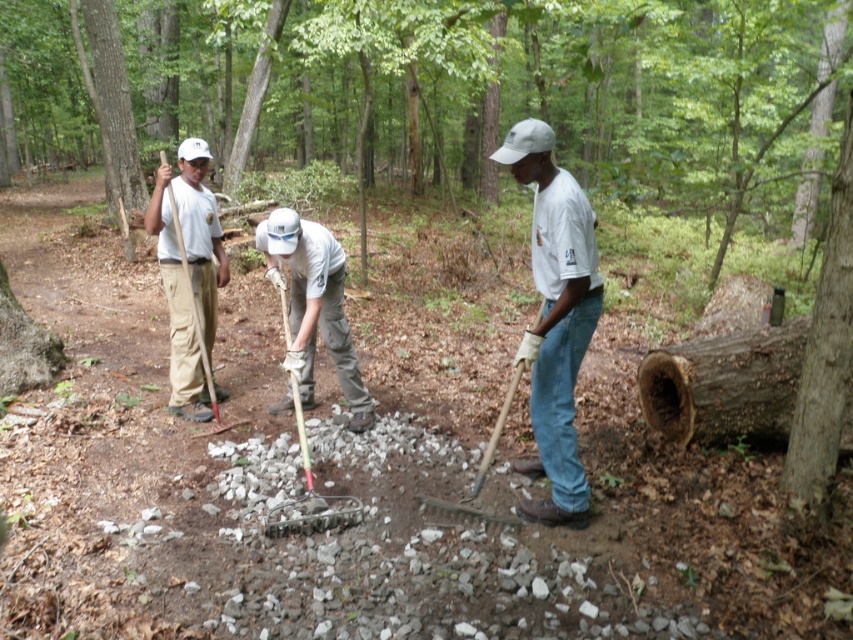
Which is in front, point (106, 195) or point (335, 509)?

Point (335, 509) is in front.

Who is higher up, smooth brown tree trunk at upper left or wooden handle shovel at center?

smooth brown tree trunk at upper left is above.

Between point (120, 54) and point (334, 500), which one is positioned in front?

Point (334, 500) is in front.

The height and width of the screenshot is (640, 853). I want to click on smooth brown tree trunk at upper left, so click(x=109, y=102).

Does white matte shirt at center have a greater width compared to smooth brown tree trunk at upper left?

No.

The height and width of the screenshot is (640, 853). What do you see at coordinates (555, 317) in the screenshot?
I see `white matte shirt at center` at bounding box center [555, 317].

Identify the location of white matte shirt at center. (555, 317).

Is matte khaki pants at left thinner than white cotton shirt at center?

Indeed, matte khaki pants at left has a lesser width compared to white cotton shirt at center.

Describe the element at coordinates (187, 269) in the screenshot. I see `matte khaki pants at left` at that location.

What do you see at coordinates (187, 269) in the screenshot?
I see `matte khaki pants at left` at bounding box center [187, 269].

The height and width of the screenshot is (640, 853). I want to click on matte khaki pants at left, so click(x=187, y=269).